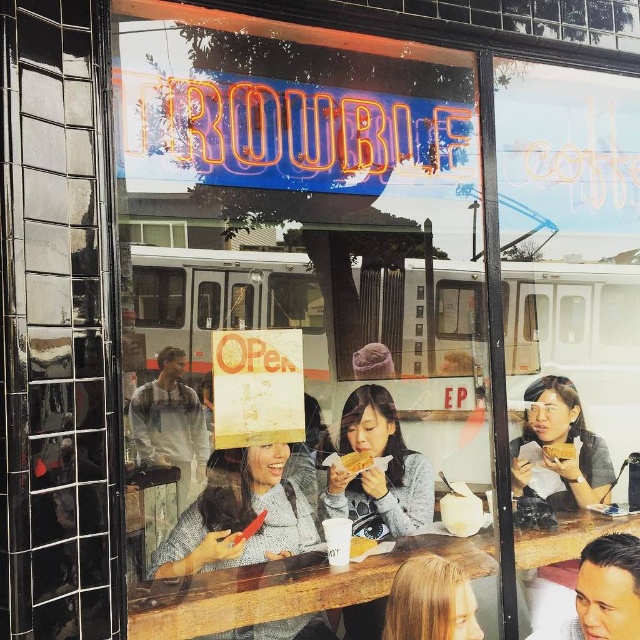
Question: Among these objects, which one is farthest from the camera?

Choices:
 (A) matte white bread at center
 (B) matte gray shirt at right
 (C) wooden table at center

Answer: (B)

Question: Can you confirm if gray sweater at center is wider than matte gray shirt at right?

Choices:
 (A) no
 (B) yes

Answer: (A)

Question: Which point is closer to the camera?

Choices:
 (A) (340, 458)
 (B) (564, 440)
 (C) (385, 492)
 (D) (579, 522)

Answer: (A)

Question: Which object is farther from the camera taking this photo?

Choices:
 (A) matte brown pastry at right
 (B) wooden table at center
 (C) yellow matte bread at center

Answer: (A)

Question: Is matte brown pastry at right positioned before yellow matte bread at center?

Choices:
 (A) yes
 (B) no

Answer: (B)

Question: Is light gray sweater at center thinner than blonde hair at center?

Choices:
 (A) yes
 (B) no

Answer: (A)